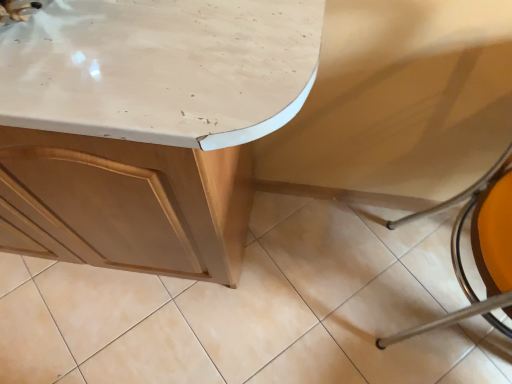
Where is `free spot in front of matte wood cabinet at center`? The height and width of the screenshot is (384, 512). free spot in front of matte wood cabinet at center is located at coordinates (136, 334).